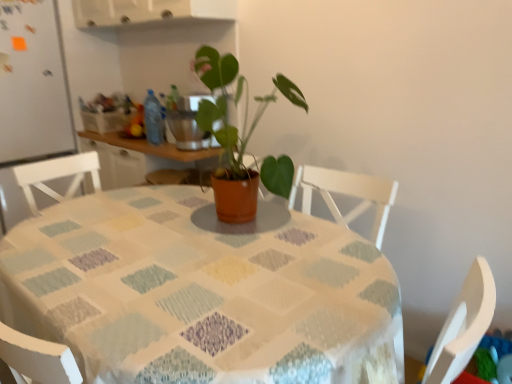
Measure the distance between point (x=147, y=92) and camera.

The distance of point (x=147, y=92) from camera is 3.00 meters.

Where is `white matte refrigerator at left`? white matte refrigerator at left is located at coordinates (31, 97).

The height and width of the screenshot is (384, 512). Describe the element at coordinates (203, 292) in the screenshot. I see `textured fabric tablecloth at center` at that location.

Locate an element on the screen. The width and height of the screenshot is (512, 384). blue plastic bottle at center is located at coordinates (153, 119).

From a real-world perspective, is white matte refrigerator at left on top of matte terracotta pot at center?

No, from a real-world perspective, white matte refrigerator at left is not on top of matte terracotta pot at center.

Is white matte refrigerator at left at the left side of matte terracotta pot at center?

Correct, you'll find white matte refrigerator at left to the left of matte terracotta pot at center.

Is white matte refrigerator at left positioned in front of matte terracotta pot at center?

No, white matte refrigerator at left is behind matte terracotta pot at center.

Looking at this image, considering the sizes of white matte refrigerator at left and matte terracotta pot at center in the image, is white matte refrigerator at left wider or thinner than matte terracotta pot at center?

white matte refrigerator at left is wider than matte terracotta pot at center.

Would you say matte terracotta pot at center is part of blue plastic bottle at center's contents?

Actually, matte terracotta pot at center is outside blue plastic bottle at center.

Can you confirm if blue plastic bottle at center is taller than matte terracotta pot at center?

No.

Considering the relative positions of blue plastic bottle at center and matte terracotta pot at center in the image provided, is blue plastic bottle at center behind matte terracotta pot at center?

Yes, it is behind matte terracotta pot at center.

Is blue plastic bottle at center facing away from matte terracotta pot at center?

No, blue plastic bottle at center is not facing away from matte terracotta pot at center.

Consider the image. Is blue plastic bottle at center inside or outside of textured fabric tablecloth at center?

blue plastic bottle at center is located beyond the bounds of textured fabric tablecloth at center.

Consider the image. From the image's perspective, who appears lower, blue plastic bottle at center or textured fabric tablecloth at center?

textured fabric tablecloth at center.

From the picture: Is blue plastic bottle at center at the right side of textured fabric tablecloth at center?

No.

You are a GUI agent. You are given a task and a screenshot of the screen. Output one action in this format:
    pyautogui.click(x=<x>, y=<y>)
    Task: Click on the table in front of the blue plastic bottle at center
    The height and width of the screenshot is (384, 512).
    Given the screenshot: What is the action you would take?
    pyautogui.click(x=203, y=292)

What are the coordinates of `houseplant that appears above the textured fabric tablecloth at center (from a real-world perspective)` in the screenshot? It's located at (243, 155).

Is matte terracotta pot at center taller or shorter than textured fabric tablecloth at center?

In the image, matte terracotta pot at center appears to be shorter than textured fabric tablecloth at center.

Can you tell me how much matte terracotta pot at center and textured fabric tablecloth at center differ in facing direction?

There is a 2.29-degree angle between the facing directions of matte terracotta pot at center and textured fabric tablecloth at center.

Which is nearer, (265, 169) or (262, 299)?

Point (265, 169).

From the image's perspective, is matte terracotta pot at center under white matte refrigerator at left?

Indeed, from the image's perspective, matte terracotta pot at center is shown beneath white matte refrigerator at left.

Considering the sizes of matte terracotta pot at center and white matte refrigerator at left in the image, is matte terracotta pot at center taller or shorter than white matte refrigerator at left?

matte terracotta pot at center is shorter than white matte refrigerator at left.

Considering the positions of point (239, 215) and point (23, 150), is point (239, 215) closer or farther from the camera than point (23, 150)?

Point (239, 215) is closer to the camera than point (23, 150).

How different are the orientations of matte terracotta pot at center and white matte refrigerator at left in degrees?

The angle between the facing direction of matte terracotta pot at center and the facing direction of white matte refrigerator at left is 87.1 degrees.

Locate an element on the screen. houseplant on the right of textured fabric tablecloth at center is located at coordinates (243, 155).

Which object is more forward, textured fabric tablecloth at center or matte terracotta pot at center?

Positioned in front is textured fabric tablecloth at center.

Is point (111, 212) closer to viewer compared to point (257, 116)?

That is True.

Between textured fabric tablecloth at center and matte terracotta pot at center, which one appears on the right side from the viewer's perspective?

From the viewer's perspective, matte terracotta pot at center appears more on the right side.

Based on the photo, is textured fabric tablecloth at center at the back of white matte refrigerator at left?

No, white matte refrigerator at left is not facing away from textured fabric tablecloth at center.

Is textured fabric tablecloth at center completely or partially inside white matte refrigerator at left?

That's incorrect, textured fabric tablecloth at center is not inside white matte refrigerator at left.

Is white matte refrigerator at left closer to camera compared to textured fabric tablecloth at center?

No, white matte refrigerator at left is behind textured fabric tablecloth at center.

From the picture: From the image's perspective, does white matte refrigerator at left appear higher than textured fabric tablecloth at center?

Indeed, from the image's perspective, white matte refrigerator at left is shown above textured fabric tablecloth at center.

You are a GUI agent. You are given a task and a screenshot of the screen. Output one action in this format:
    pyautogui.click(x=<x>, y=<y>)
    Task: Click on the houseplant on the right of white matte refrigerator at left
    
    Given the screenshot: What is the action you would take?
    pyautogui.click(x=243, y=155)

You are a GUI agent. You are given a task and a screenshot of the screen. Output one action in this format:
    pyautogui.click(x=<x>, y=<y>)
    Task: Click on the bottle behind the matte terracotta pot at center
    
    Given the screenshot: What is the action you would take?
    pos(153,119)

When comparing their distances from textured fabric tablecloth at center, does matte terracotta pot at center or blue plastic bottle at center seem closer?

Based on the image, matte terracotta pot at center appears to be nearer to textured fabric tablecloth at center.

Consider the image. Based on their spatial positions, is textured fabric tablecloth at center or matte terracotta pot at center further from white matte refrigerator at left?

textured fabric tablecloth at center.

Looking at the image, which one is located closer to white matte refrigerator at left, matte terracotta pot at center or blue plastic bottle at center?

blue plastic bottle at center is positioned closer to the anchor white matte refrigerator at left.

Looking at the image, which one is located further to matte terracotta pot at center, blue plastic bottle at center or textured fabric tablecloth at center?

blue plastic bottle at center is further to matte terracotta pot at center.

From the image, which object appears to be nearer to white matte refrigerator at left, blue plastic bottle at center or matte terracotta pot at center?

Among the two, blue plastic bottle at center is located nearer to white matte refrigerator at left.

Estimate the real-world distances between objects in this image. Which object is further from matte terracotta pot at center, blue plastic bottle at center or white matte refrigerator at left?

Based on the image, white matte refrigerator at left appears to be further to matte terracotta pot at center.

Estimate the real-world distances between objects in this image. Which object is further from blue plastic bottle at center, textured fabric tablecloth at center or matte terracotta pot at center?

textured fabric tablecloth at center lies further to blue plastic bottle at center than the other object.

When comparing their distances from textured fabric tablecloth at center, does white matte refrigerator at left or blue plastic bottle at center seem further?

Among the two, white matte refrigerator at left is located further to textured fabric tablecloth at center.

The height and width of the screenshot is (384, 512). What are the coordinates of `fridge between textured fabric tablecloth at center and blue plastic bottle at center in the front-back direction` in the screenshot? It's located at (31, 97).

Identify the location of houseplant between textured fabric tablecloth at center and white matte refrigerator at left from front to back. This screenshot has width=512, height=384. (243, 155).

The image size is (512, 384). I want to click on bottle between white matte refrigerator at left and matte terracotta pot at center from left to right, so click(x=153, y=119).

At what (x,y) coordinates should I click in order to perform the action: click on houseplant between textured fabric tablecloth at center and blue plastic bottle at center from front to back. Please return your answer as a coordinate pair (x, y). The height and width of the screenshot is (384, 512). Looking at the image, I should click on (243, 155).